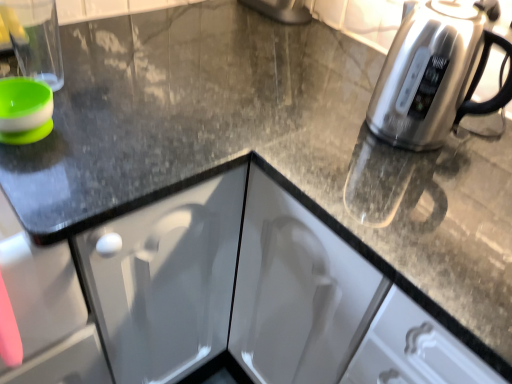
Identify the location of blank space to the left of satin silver kettle at right. The width and height of the screenshot is (512, 384). (319, 142).